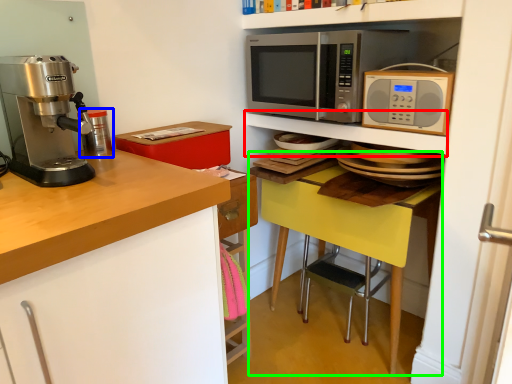
Question: Estimate the real-world distances between objects in this image. Which object is farther from shelf (highlighted by a red box), appliance (highlighted by a blue box) or table (highlighted by a green box)?

Choices:
 (A) appliance
 (B) table

Answer: (A)